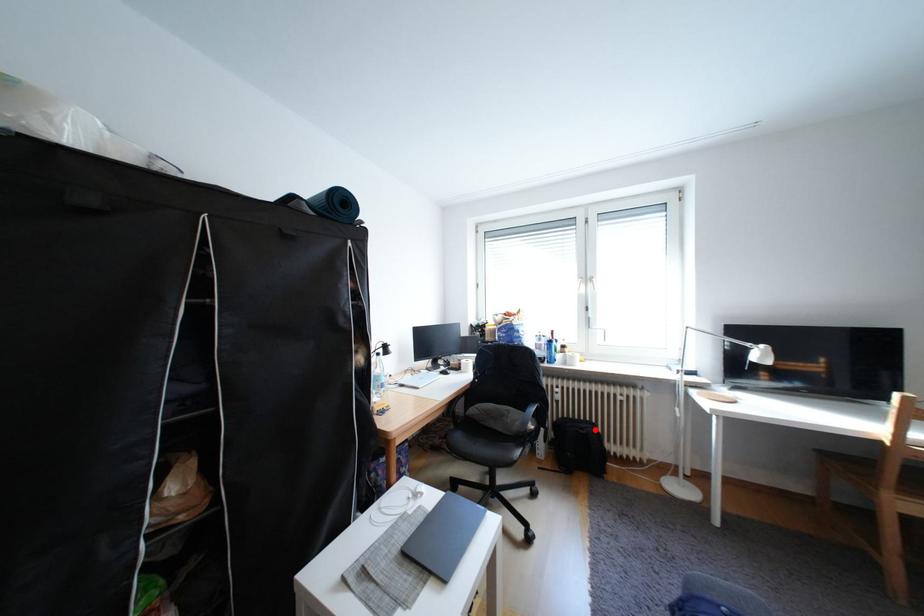
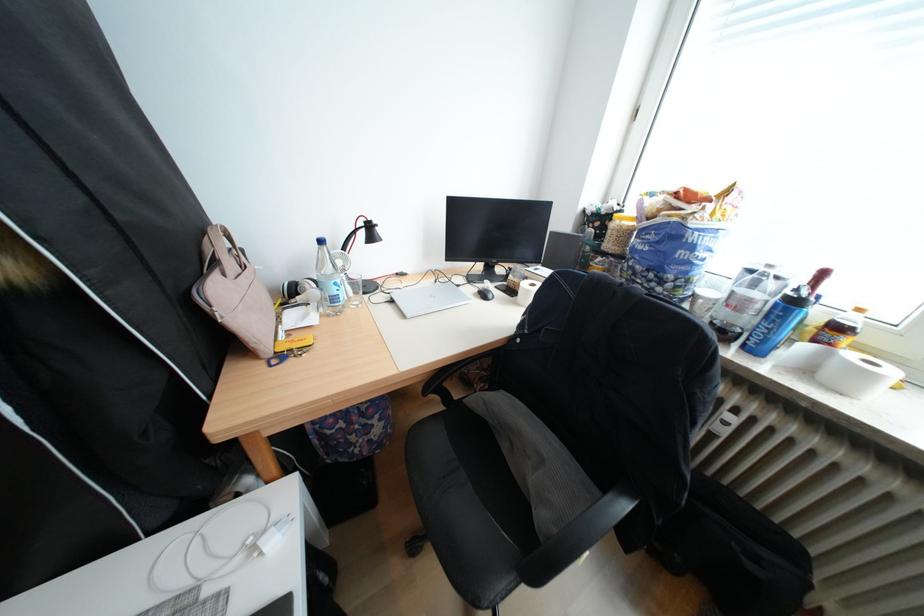
Question: I am providing you with two images of the same scene from different viewpoints. Given a red point in image1, look at the same physical point in image2. Is it:

Choices:
 (A) Closer to the viewpoint
 (B) Farther from the viewpoint

Answer: (A)